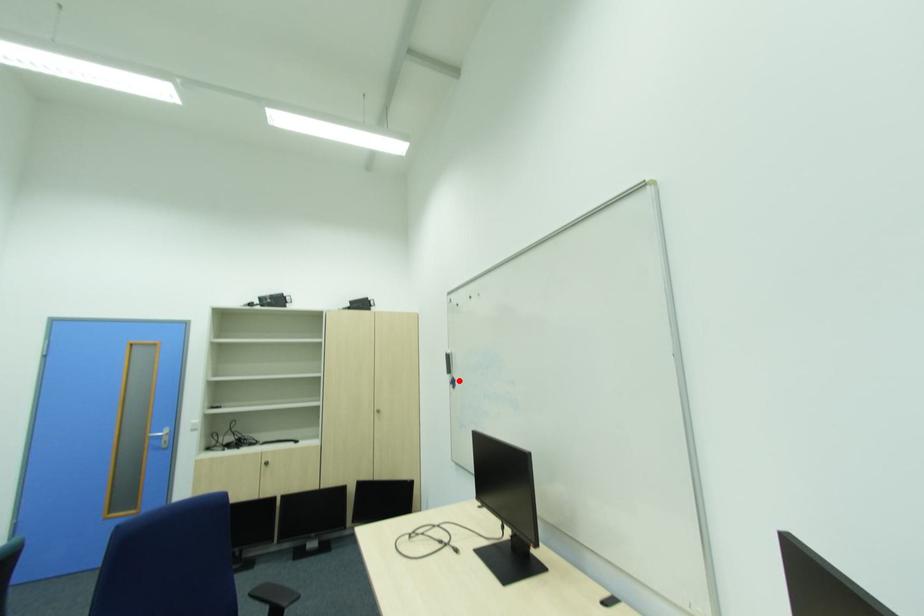
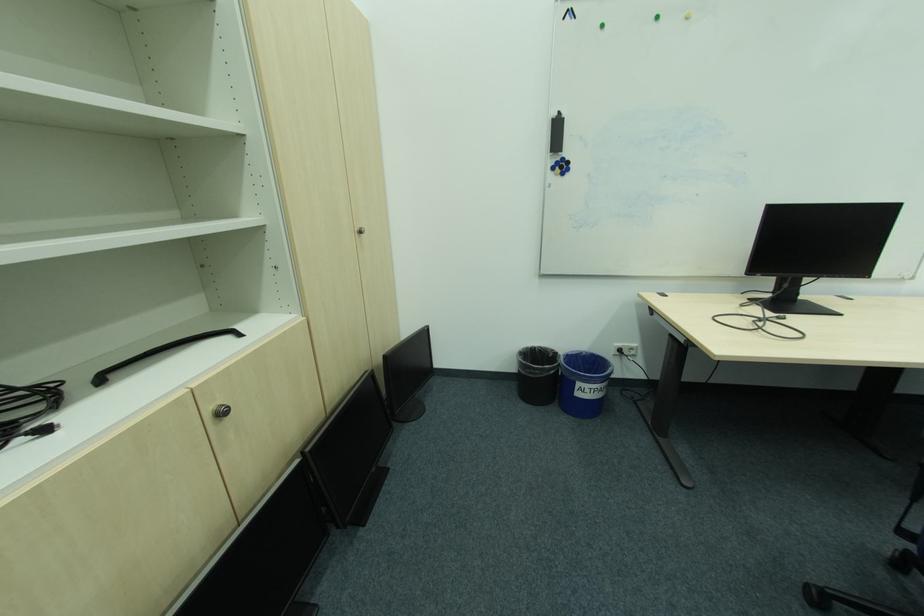
In the second image, find the point that corresponds to the highlighted location in the first image.

(565, 163)